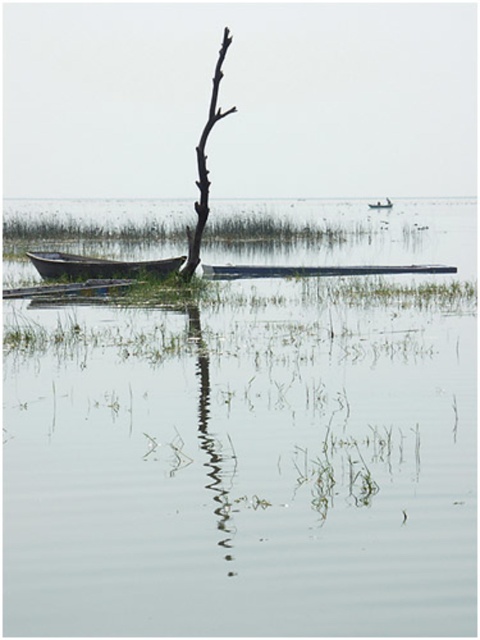
You are standing at the edge of the lake and see two points marked in the image. Which point is closer to you, point (188,236) or point (375,209)?

Point (188,236) is closer to the viewer than point (375,209).

You are an observer standing on the shore of the lake. You see the wooden canoe at left and the wooden boat at center. Which object takes up more area in the image?

The wooden boat at center occupies more space than the wooden canoe at left.

You are an adventurer planning to cross the lake using either the wooden canoe at left or the wooden boat at center. Considering their sizes, which one would you choose for better stability?

The wooden boat at center is wider than the wooden canoe at left, so it would provide better stability for crossing the lake.